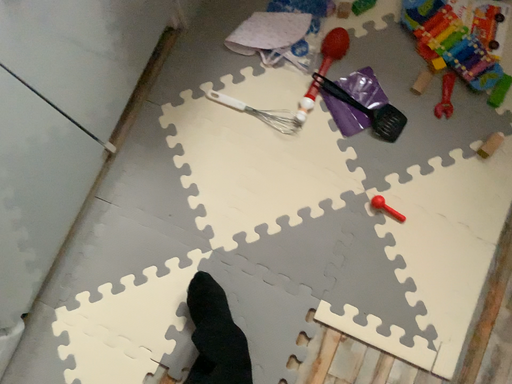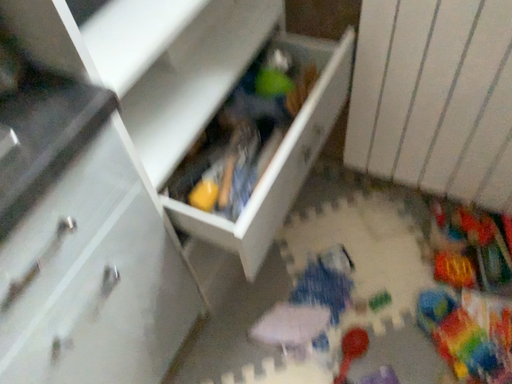
Question: Which way did the camera rotate in the video?

Choices:
 (A) rotated upward
 (B) rotated downward

Answer: (A)